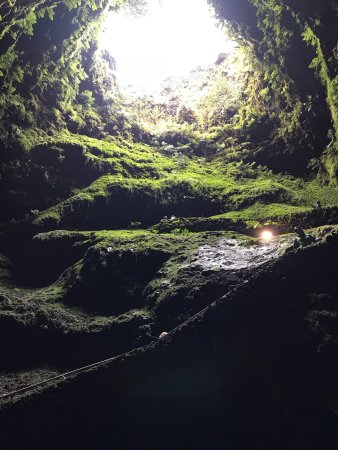
At what (x,y) coordinates should I click in order to perform the action: click on green ferns. Please return your answer as a coordinate pair (x, y). The image size is (338, 450). Looking at the image, I should click on (305, 32).